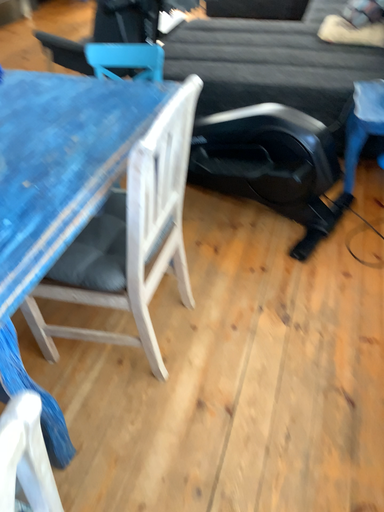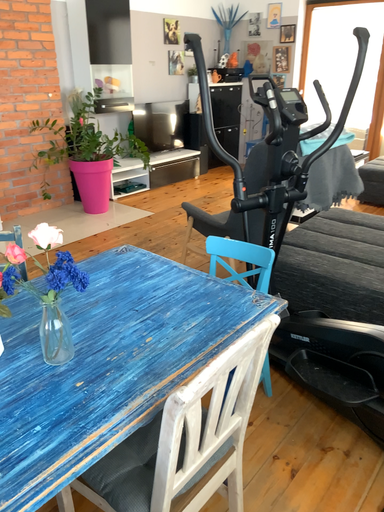
Question: How did the camera likely rotate when shooting the video?

Choices:
 (A) rotated downward
 (B) rotated upward

Answer: (B)